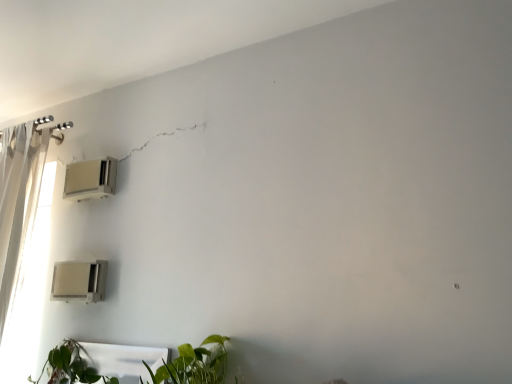
Image resolution: width=512 pixels, height=384 pixels. Find the location of `white plastic air conditioner at upper left, acting as the 2th air conditioning starting from the bottom`. white plastic air conditioner at upper left, acting as the 2th air conditioning starting from the bottom is located at coordinates (90, 179).

Locate an element on the screen. white plastic air conditioner at upper left, acting as the 2th air conditioning starting from the bottom is located at coordinates (90, 179).

In the scene shown: From the image's perspective, is beige plastic air conditioner at lower left, arranged as the 1th air conditioning when ordered from the bottom, above or below white plastic air conditioner at upper left, the 1th air conditioning positioned from the top?

Based on their image positions, beige plastic air conditioner at lower left, arranged as the 1th air conditioning when ordered from the bottom, is located beneath white plastic air conditioner at upper left, the 1th air conditioning positioned from the top.

Are beige plastic air conditioner at lower left, arranged as the 1th air conditioning when ordered from the bottom, and white plastic air conditioner at upper left, the 1th air conditioning positioned from the top, located far from each other?

No, beige plastic air conditioner at lower left, arranged as the 1th air conditioning when ordered from the bottom, is not far away from white plastic air conditioner at upper left, the 1th air conditioning positioned from the top.

From a real-world perspective, is beige plastic air conditioner at lower left, the 2th air conditioning positioned from the top, positioned under white plastic air conditioner at upper left, acting as the 2th air conditioning starting from the bottom, based on gravity?

Correct, in the physical world, beige plastic air conditioner at lower left, the 2th air conditioning positioned from the top, is lower than white plastic air conditioner at upper left, acting as the 2th air conditioning starting from the bottom.

Which of these two, white plastic air conditioner at upper left, acting as the 2th air conditioning starting from the bottom, or beige plastic air conditioner at lower left, arranged as the 1th air conditioning when ordered from the bottom, is thinner?

white plastic air conditioner at upper left, acting as the 2th air conditioning starting from the bottom, is thinner.

Based on the photo, is white plastic air conditioner at upper left, acting as the 2th air conditioning starting from the bottom, oriented away from beige plastic air conditioner at lower left, the 2th air conditioning positioned from the top?

No, white plastic air conditioner at upper left, acting as the 2th air conditioning starting from the bottom, is not facing the opposite direction of beige plastic air conditioner at lower left, the 2th air conditioning positioned from the top.

From a real-world perspective, which object rests below the other?

beige plastic air conditioner at lower left, arranged as the 1th air conditioning when ordered from the bottom, is physically lower.

Is green leafy plant at lower center wider than beige plastic air conditioner at lower left, the 2th air conditioning positioned from the top?

Yes.

Between green leafy plant at lower center and beige plastic air conditioner at lower left, the 2th air conditioning positioned from the top, which one has less height?

With less height is green leafy plant at lower center.

From a real-world perspective, who is located higher, green leafy plant at lower center or beige plastic air conditioner at lower left, the 2th air conditioning positioned from the top?

beige plastic air conditioner at lower left, the 2th air conditioning positioned from the top, is physically above.

From the image's perspective, is green leafy plant at lower center on white plastic air conditioner at upper left, acting as the 2th air conditioning starting from the bottom?

No, from the image's perspective, green leafy plant at lower center is not on top of white plastic air conditioner at upper left, acting as the 2th air conditioning starting from the bottom.

Is green leafy plant at lower center further to camera compared to white plastic air conditioner at upper left, acting as the 2th air conditioning starting from the bottom?

No, the depth of green leafy plant at lower center is less than that of white plastic air conditioner at upper left, acting as the 2th air conditioning starting from the bottom.

Between point (192, 379) and point (106, 193), which one is positioned in front?

The point (192, 379) is closer to the camera.

Based on the photo, could you tell me if green leafy plant at lower center is turned towards white plastic air conditioner at upper left, the 1th air conditioning positioned from the top?

No.

Considering the points (66, 197) and (182, 351), which point is behind, point (66, 197) or point (182, 351)?

The point (66, 197) is farther from the camera.

Is white plastic air conditioner at upper left, the 1th air conditioning positioned from the top, located outside green leafy plant at lower center?

Absolutely, white plastic air conditioner at upper left, the 1th air conditioning positioned from the top, is external to green leafy plant at lower center.

Looking at this image, from the image's perspective, is white plastic air conditioner at upper left, the 1th air conditioning positioned from the top, above green leafy plant at lower center?

Yes, from the image's perspective, white plastic air conditioner at upper left, the 1th air conditioning positioned from the top, is on top of green leafy plant at lower center.

In terms of height, does white plastic air conditioner at upper left, the 1th air conditioning positioned from the top, look taller or shorter compared to green leafy plant at lower center?

Clearly, white plastic air conditioner at upper left, the 1th air conditioning positioned from the top, is taller compared to green leafy plant at lower center.

Which object is more forward, beige plastic air conditioner at lower left, arranged as the 1th air conditioning when ordered from the bottom, or green leafy plant at lower center?

green leafy plant at lower center is closer to the camera.

Which is in front, point (75, 262) or point (74, 355)?

The point (74, 355) is closer to the camera.

Based on the photo, from the image's perspective, who appears lower, beige plastic air conditioner at lower left, the 2th air conditioning positioned from the top, or green leafy plant at lower center?

green leafy plant at lower center.

Is beige plastic air conditioner at lower left, the 2th air conditioning positioned from the top, facing away from green leafy plant at lower center?

No, beige plastic air conditioner at lower left, the 2th air conditioning positioned from the top, is not facing the opposite direction of green leafy plant at lower center.

You are a GUI agent. You are given a task and a screenshot of the screen. Output one action in this format:
    pyautogui.click(x=<x>, y=<y>)
    Task: Click on the air conditioning above the beige plastic air conditioner at lower left, the 2th air conditioning positioned from the top (from the image's perspective)
    The image size is (512, 384).
    Given the screenshot: What is the action you would take?
    pyautogui.click(x=90, y=179)

Locate an element on the screen. The width and height of the screenshot is (512, 384). air conditioning in front of the white plastic air conditioner at upper left, the 1th air conditioning positioned from the top is located at coordinates (x=79, y=281).

In the scene shown: Based on their spatial positions, is green leafy plant at lower center or white plastic air conditioner at upper left, the 1th air conditioning positioned from the top, further from beige plastic air conditioner at lower left, the 2th air conditioning positioned from the top?

white plastic air conditioner at upper left, the 1th air conditioning positioned from the top, is positioned further to the anchor beige plastic air conditioner at lower left, the 2th air conditioning positioned from the top.

Estimate the real-world distances between objects in this image. Which object is further from green leafy plant at lower center, beige plastic air conditioner at lower left, arranged as the 1th air conditioning when ordered from the bottom, or white plastic air conditioner at upper left, the 1th air conditioning positioned from the top?

Based on the image, white plastic air conditioner at upper left, the 1th air conditioning positioned from the top, appears to be further to green leafy plant at lower center.

Looking at the image, which one is located further to beige plastic air conditioner at lower left, the 2th air conditioning positioned from the top, white plastic air conditioner at upper left, the 1th air conditioning positioned from the top, or green leafy plant at lower center?

Among the two, white plastic air conditioner at upper left, the 1th air conditioning positioned from the top, is located further to beige plastic air conditioner at lower left, the 2th air conditioning positioned from the top.

When comparing their distances from white plastic air conditioner at upper left, the 1th air conditioning positioned from the top, does green leafy plant at lower center or beige plastic air conditioner at lower left, the 2th air conditioning positioned from the top, seem closer?

Based on the image, beige plastic air conditioner at lower left, the 2th air conditioning positioned from the top, appears to be nearer to white plastic air conditioner at upper left, the 1th air conditioning positioned from the top.

When comparing their distances from green leafy plant at lower center, does white plastic air conditioner at upper left, acting as the 2th air conditioning starting from the bottom, or beige plastic air conditioner at lower left, the 2th air conditioning positioned from the top, seem further?

white plastic air conditioner at upper left, acting as the 2th air conditioning starting from the bottom.

Looking at the image, which one is located further to white plastic air conditioner at upper left, the 1th air conditioning positioned from the top, beige plastic air conditioner at lower left, the 2th air conditioning positioned from the top, or green leafy plant at lower center?

green leafy plant at lower center lies further to white plastic air conditioner at upper left, the 1th air conditioning positioned from the top, than the other object.

This screenshot has height=384, width=512. I want to click on air conditioning between green leafy plant at lower center and white plastic air conditioner at upper left, acting as the 2th air conditioning starting from the bottom, along the z-axis, so click(79, 281).